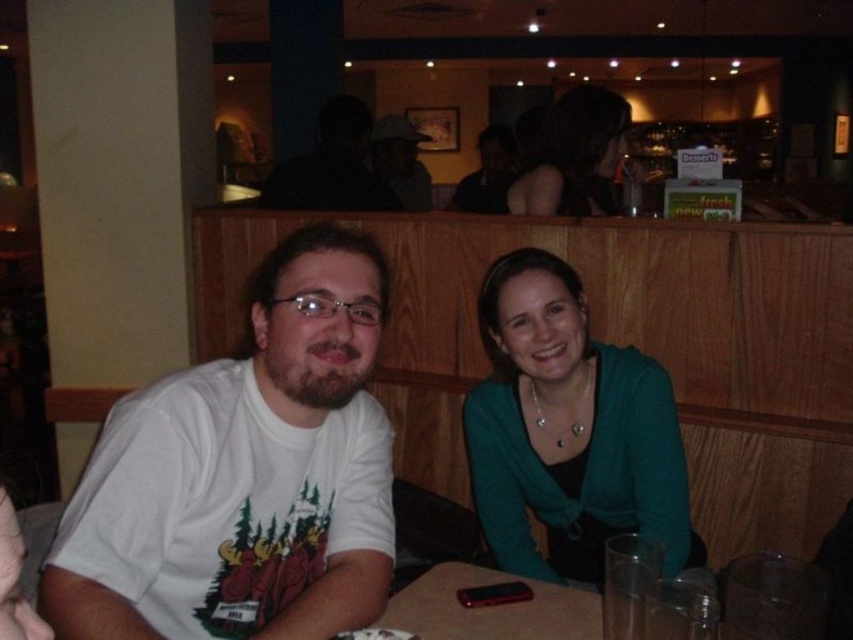
Question: Does teal sweater at center have a larger size compared to matte black shirt at upper center?

Choices:
 (A) yes
 (B) no

Answer: (B)

Question: Which of the following is the farthest from the observer?

Choices:
 (A) (424, 179)
 (B) (347, 282)

Answer: (A)

Question: Among these points, which one is farthest from the camera?

Choices:
 (A) (618, 160)
 (B) (682, 531)

Answer: (A)

Question: Which of the following is the farthest from the observer?

Choices:
 (A) white t-shirt at left
 (B) matte black hair at upper center
 (C) matte black shirt at center

Answer: (C)

Question: Does white t-shirt at left appear over matte black hair at upper center?

Choices:
 (A) no
 (B) yes

Answer: (A)

Question: Does teal sweater at center lie in front of matte black shirt at upper center?

Choices:
 (A) yes
 (B) no

Answer: (A)